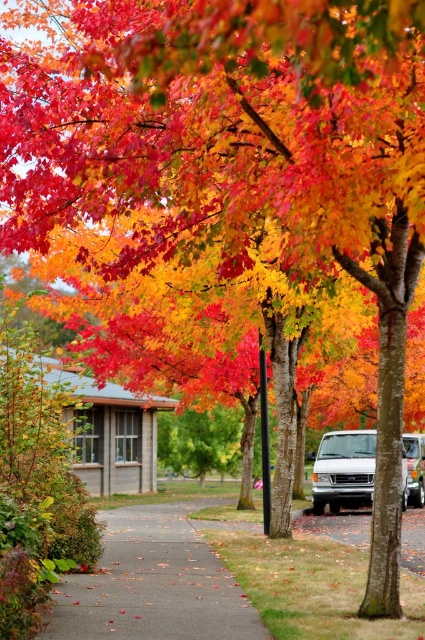
Question: Considering the relative positions of gray concrete sidewalk at center and white matte van at center in the image provided, where is gray concrete sidewalk at center located with respect to white matte van at center?

Choices:
 (A) right
 (B) left

Answer: (B)

Question: Among these points, which one is nearest to the camera?

Choices:
 (A) (139, 612)
 (B) (353, 480)

Answer: (A)

Question: Is gray concrete sidewalk at center behind white matte van at center?

Choices:
 (A) no
 (B) yes

Answer: (A)

Question: Which object appears farthest from the camera in this image?

Choices:
 (A) white matte van at center
 (B) gray concrete sidewalk at center

Answer: (A)

Question: Is gray concrete sidewalk at center to the right of white matte van at center from the viewer's perspective?

Choices:
 (A) yes
 (B) no

Answer: (B)